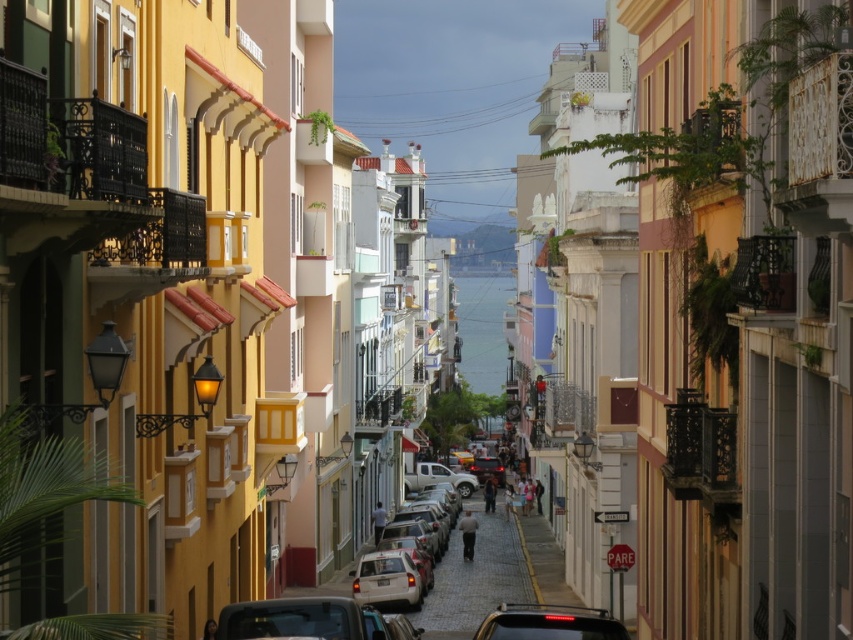
You are a delivery driver who needs to park your truck between the two cars in the street. The truck is 6 meters long. Is there enough space between the matte black car at center and the matte silver car at center to park your truck?

The matte black car at center is positioned on the right side of the matte silver car at center. However, the exact distance between them is not provided, so it is impossible to determine if there is enough space for the 6 meter long truck.

You are a tourist standing at the entrance of the street. You see a shiny black car at lower center and a matte silver car at center. Which car is bigger?

The shiny black car at lower center is larger than the matte silver car at center.

You are standing at the intersection and want to cross the street to the building with the yellow facade. There is a shiny black car at lower center. Where is the shiny black car located relative to your position?

The shiny black car at lower center is located at coordinates point (300, 620) relative to your position.